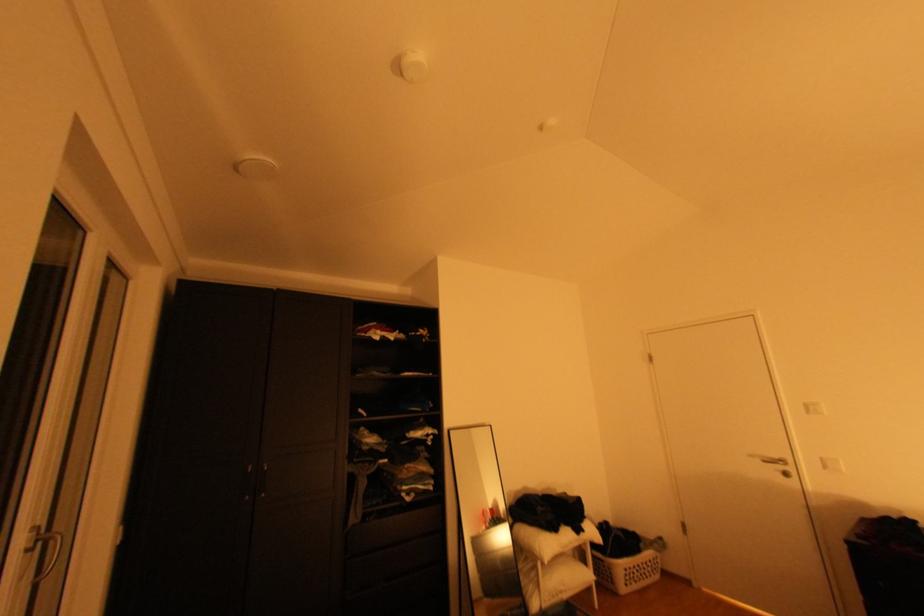
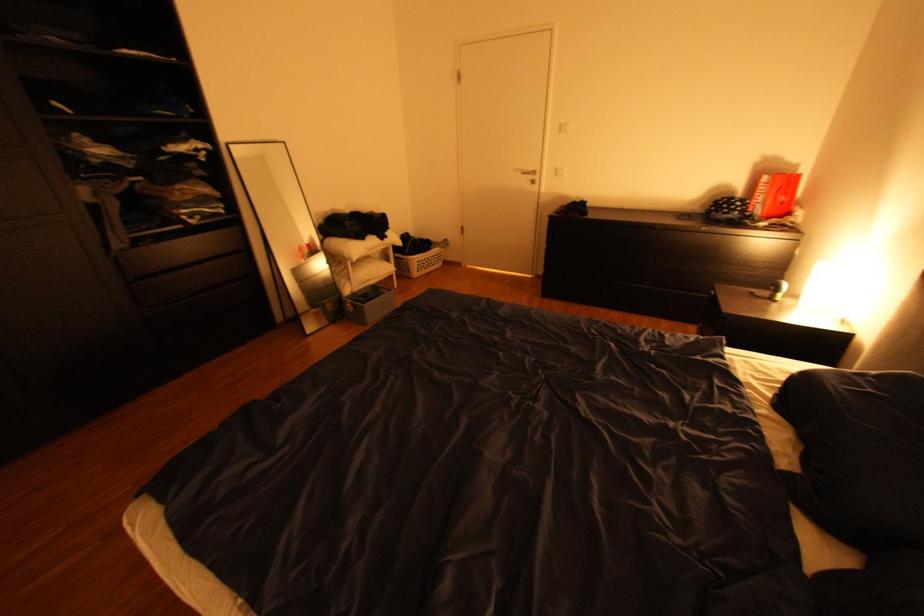
Where in the second image is the point corresponding to the point at 835,467 from the first image?

(565, 174)